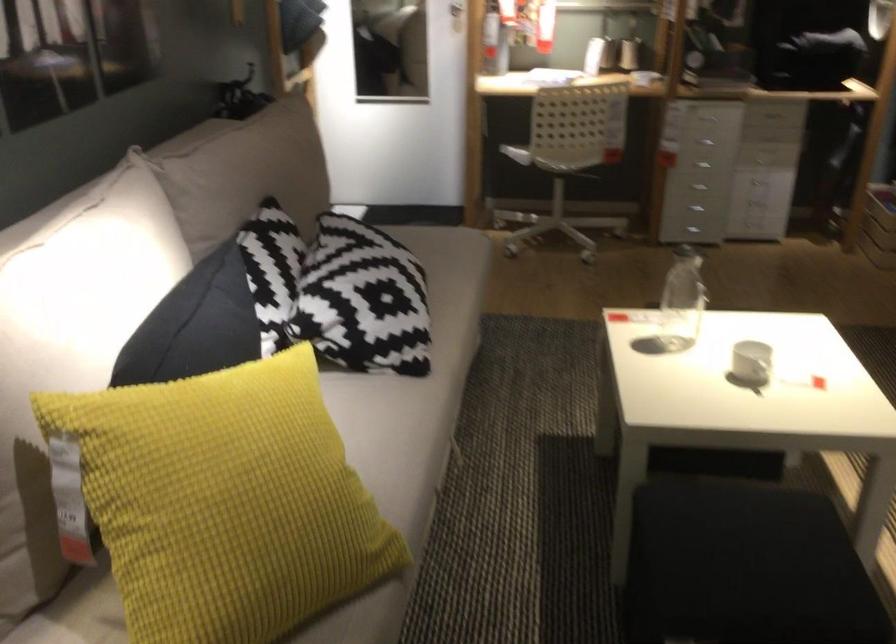
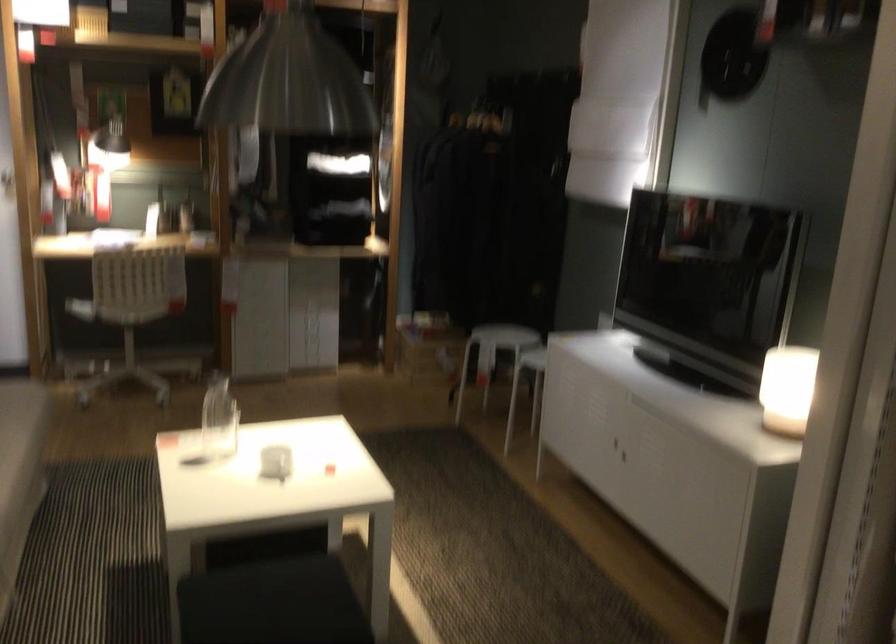
In the second image, find the point that corresponds to the point at 743,550 in the first image.

(271, 603)